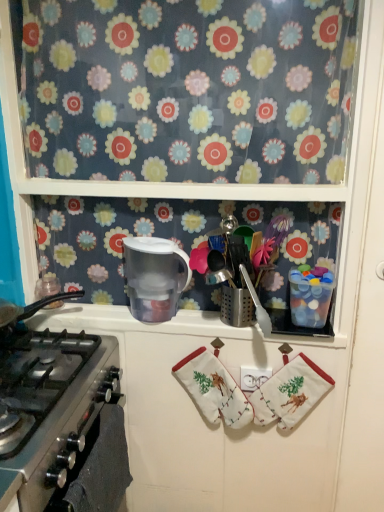
The image size is (384, 512). I want to click on free location above white cotton hand towel at center, which is the first hand towel from right to left (from a real-world perspective), so click(290, 349).